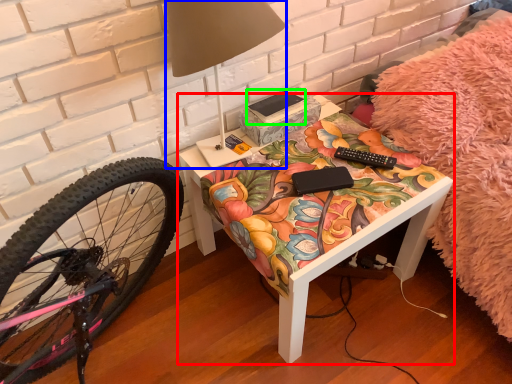
Question: Which object is the closest to the table (highlighted by a red box)? Choose among these: table lamp (highlighted by a blue box) or book (highlighted by a green box).

Choices:
 (A) table lamp
 (B) book

Answer: (B)